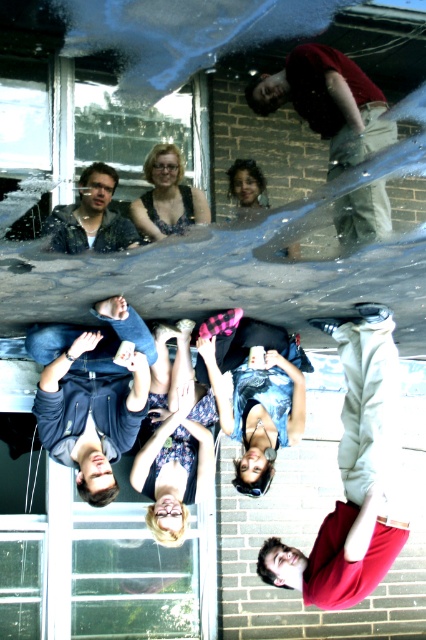
You are observing the upside down group of people in the image. Which of the two points, point (385, 189) or point (213, 380), is closer to you?

Point (385, 189) is closer to the camera than point (213, 380).

You are standing in front of the brick wall and looking at the upside down scene. Which object is positioned to the right side between the red cotton shirt at upper center and denim shorts at center?

The red cotton shirt at upper center is positioned to the right of the denim shorts at center.

You are organizing a fashion show and need to arrange the floral dress at center and the matte black dress at center based on their sizes. Which dress should be placed first if you want to start with the larger one?

The floral dress at center is bigger than the matte black dress at center, so you should place the floral dress at center first.